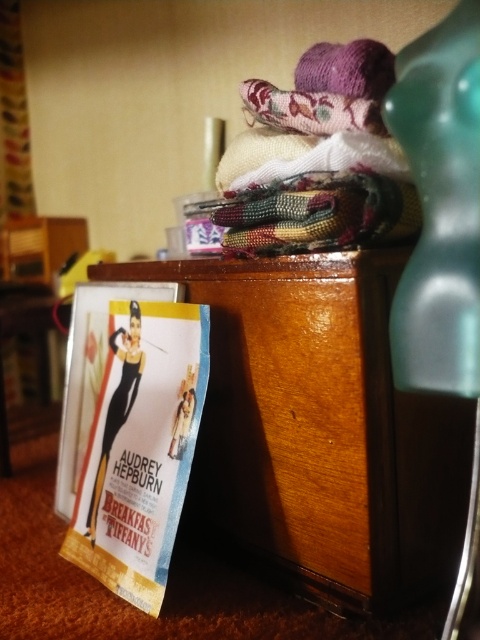
You are organizing items on a wooden surface and need to place both the wooden dresser at lower left and the matte paper poster at lower left. Since the wooden surface has limited space, which object should you prioritize keeping if you can only choose one due to size?

The wooden dresser at lower left is bigger than the matte paper poster at lower left, so you should prioritize keeping the wooden dresser at lower left because it takes up more space and might be essential for storage.

You are a photographer who needs to place a camera 60 centimeters away from the wooden dresser at lower left. Can you position it within the available space?

The wooden dresser at lower left and camera are 63.55 centimeters apart, so yes, the camera can be placed 60 centimeters away from the wooden dresser at lower left as the distance is sufficient.

You are organizing items on a wooden surface and need to place a new item between the wooden dresser at lower left and the movie poster. Where should you place it?

The wooden dresser at lower left is located at point [320,429], so place the new item between the wooden dresser at lower left and the movie poster by positioning it to the right of the wooden dresser at lower left but before reaching the movie poster.